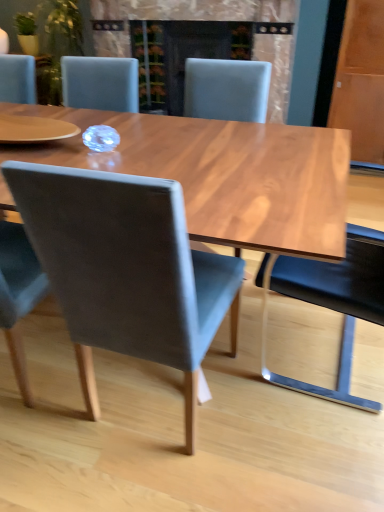
Find the location of a particular element. The height and width of the screenshot is (512, 384). vacant space in black leather chair at right, which ranks as the 1th chair in right-to-left order (from a real-world perspective) is located at coordinates (319, 346).